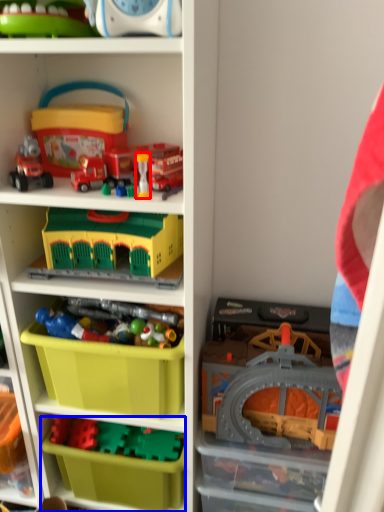
Question: Among these objects, which one is farthest to the camera, toy (highlighted by a red box) or storage box (highlighted by a blue box)?

Choices:
 (A) toy
 (B) storage box

Answer: (B)